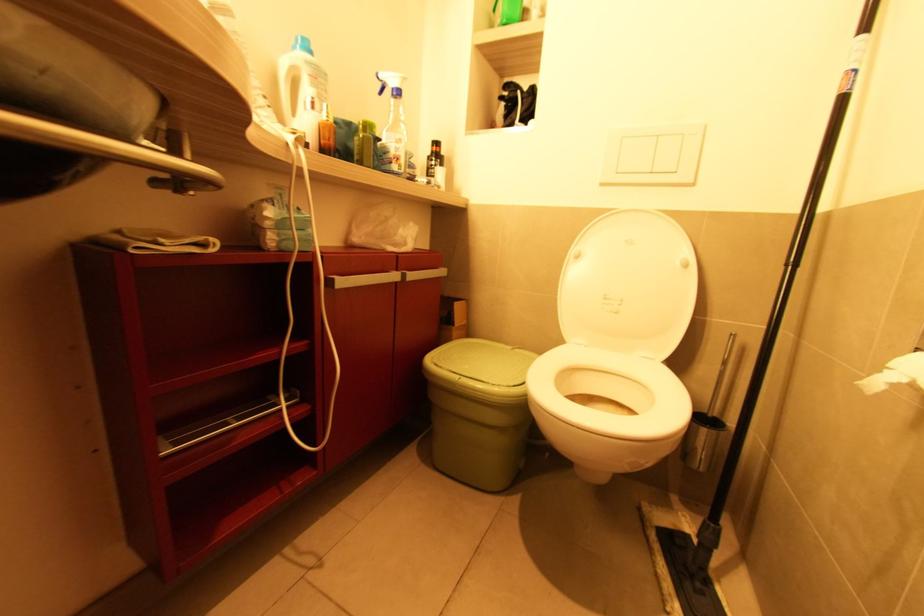
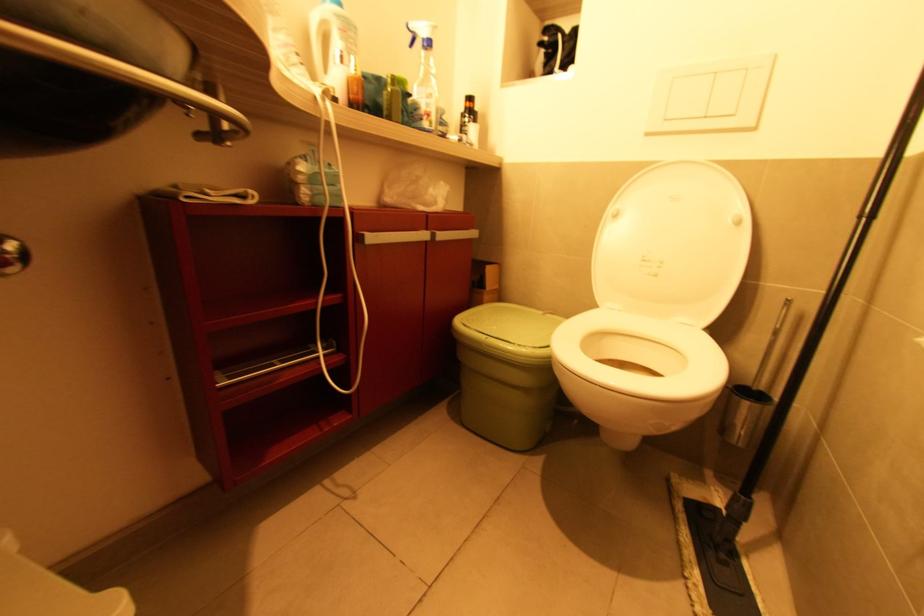
Question: What movement of the cameraman would produce the second image?

Choices:
 (A) Left
 (B) Right
 (C) Forward
 (D) Backward

Answer: (B)